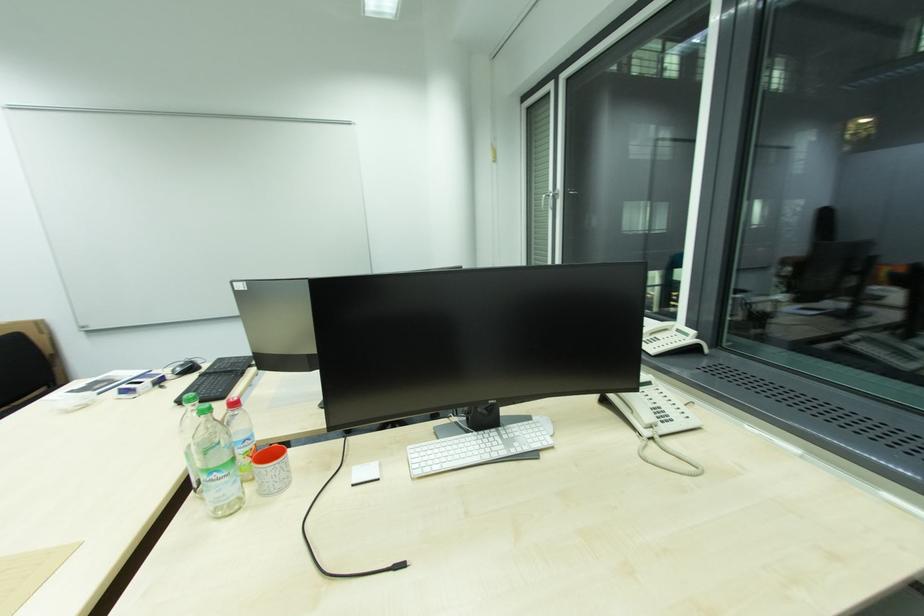
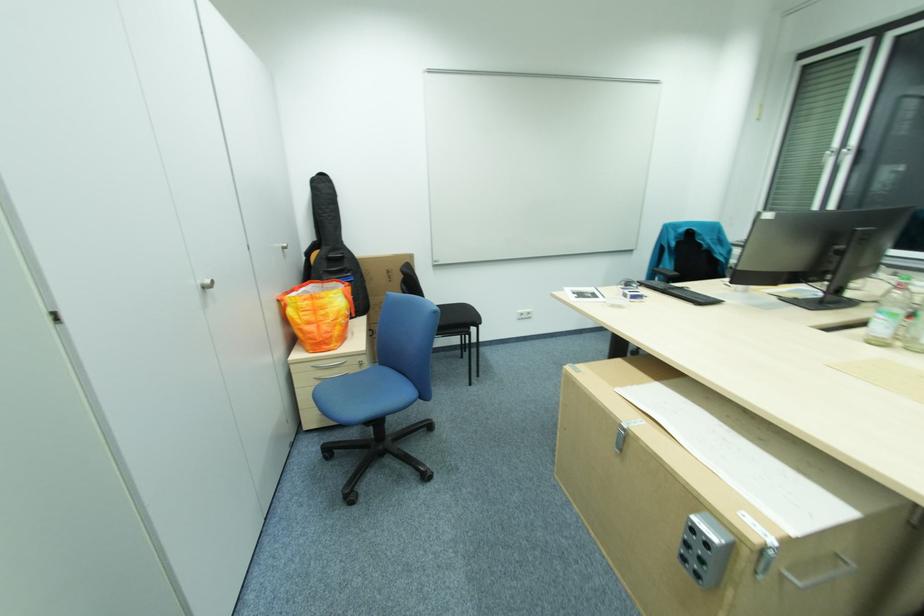
Question: In a continuous first-person perspective shot, in which direction is the camera moving?

Choices:
 (A) Left
 (B) Right
 (C) Forward
 (D) Backward

Answer: (A)